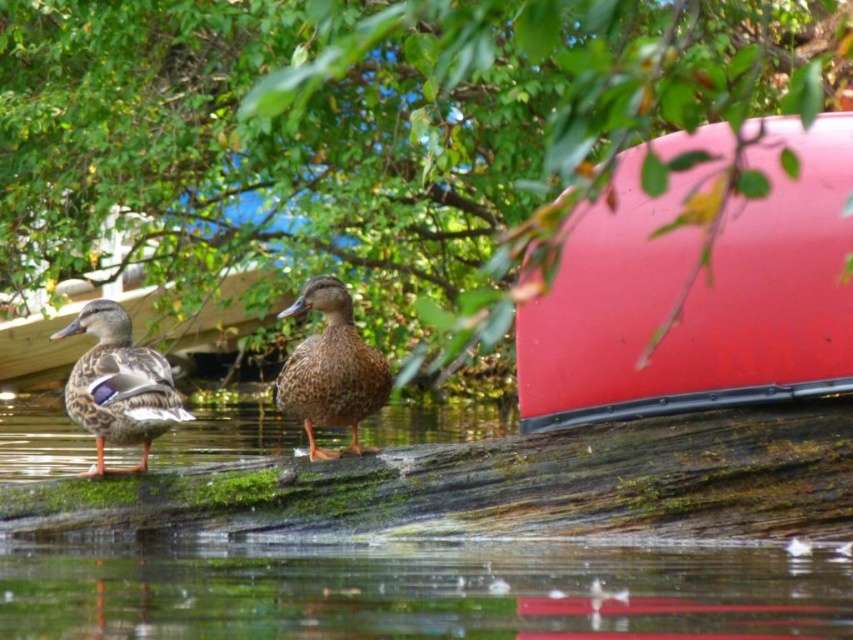
Question: Does transparent water at lower center have a larger size compared to brown matte duck at center?

Choices:
 (A) yes
 (B) no

Answer: (A)

Question: From the image, what is the correct spatial relationship of rubberized red canoe at upper right in relation to brown matte duck at left?

Choices:
 (A) below
 (B) above

Answer: (B)

Question: Which point is farther to the camera?

Choices:
 (A) (180, 397)
 (B) (457, 253)

Answer: (B)

Question: Considering the real-world distances, which object is closest to the brown matte duck at left?

Choices:
 (A) rubberized red canoe at upper right
 (B) transparent water at lower center
 (C) brown matte duck at center
 (D) green leafy tree at upper center

Answer: (C)

Question: Which of these objects is positioned farthest from the rubberized red canoe at upper right?

Choices:
 (A) green leafy tree at upper center
 (B) brown matte duck at left
 (C) transparent water at lower center

Answer: (A)

Question: Where is transparent water at lower center located in relation to brown matte duck at left in the image?

Choices:
 (A) below
 (B) above

Answer: (A)